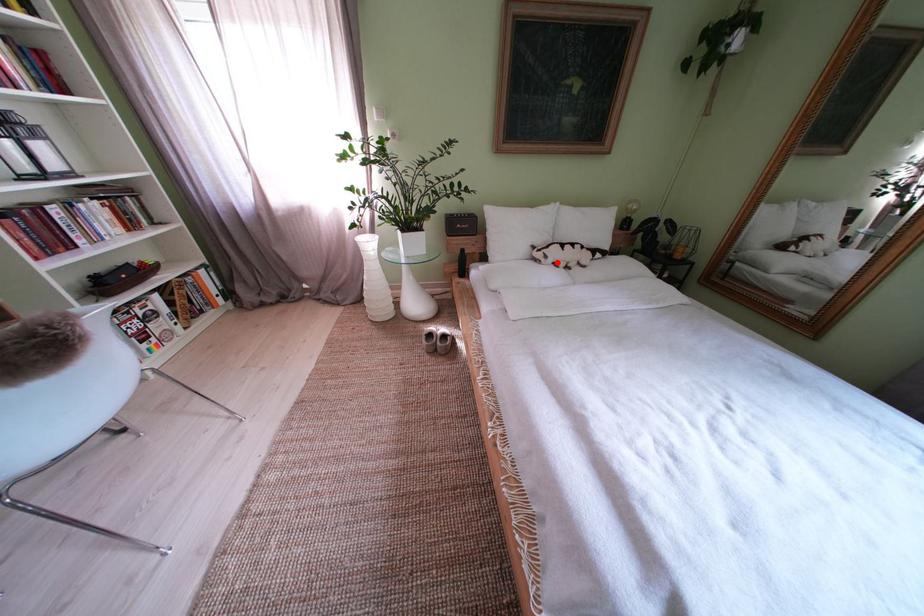
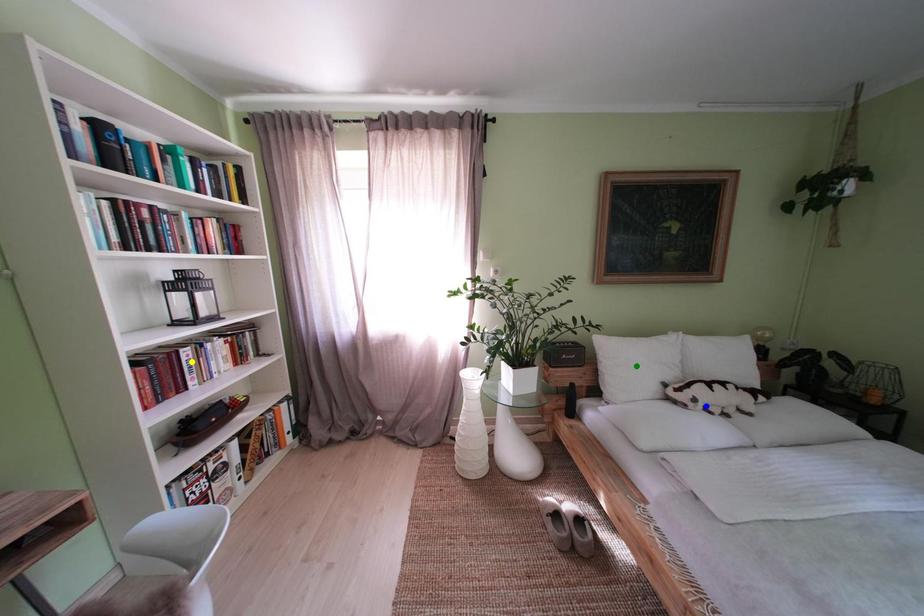
Question: I am providing you with two images of the same scene from different viewpoints. A red point is marked on the first image. You are given multiple points on the second image. In image 2, which mark is for the same physical point as the one in image 1?

Choices:
 (A) blue point
 (B) green point
 (C) yellow point

Answer: (A)